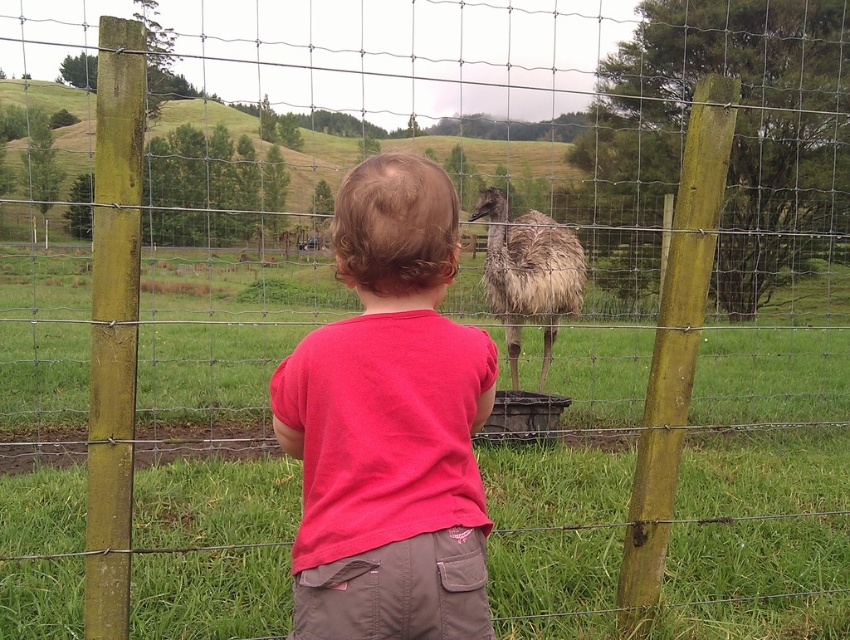
You are a photographer trying to capture a photo of the brown feathered ostrich at center while ensuring the pink cotton shirt at center is visible in the background. Given their sizes, will the ostrich completely block the view of the shirt?

The pink cotton shirt at center is smaller than the brown feathered ostrich at center, so the ostrich may block part of the shirt depending on their exact positions. To ensure the shirt is visible, adjust the angle or zoom to include both.